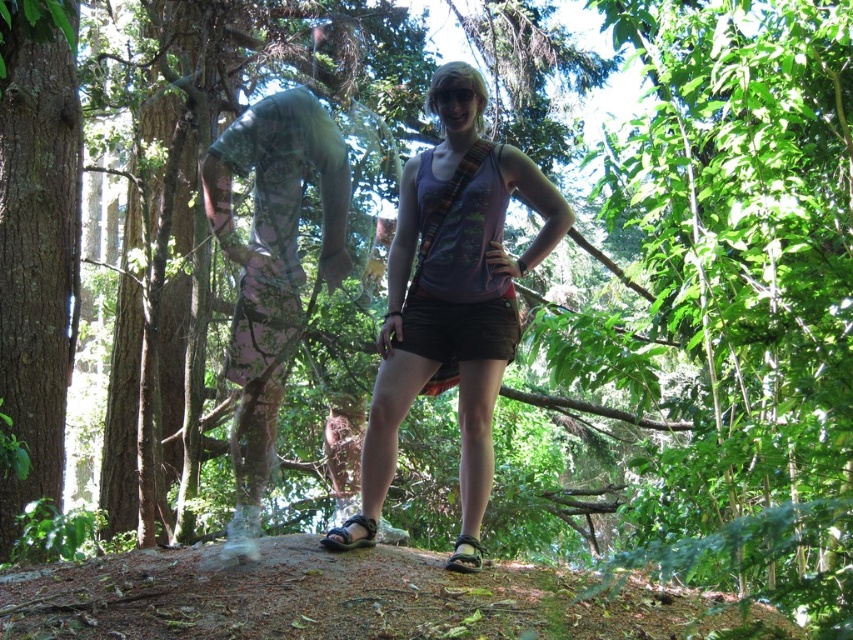
You are a photographer trying to capture both the matte purple tank top at center and the smooth brown bark at left in a single frame. Based on their positions, which object should you adjust your camera angle to focus on first to ensure both are in the frame?

The matte purple tank top at center might be wider than smooth brown bark at left, so you should focus on the matte purple tank top at center first to accommodate its width and ensure both fit in the frame.

You are a photographer trying to capture the person in the purple top. You notice a point marked at coordinates (x=451, y=300). Where exactly on the person should you focus your camera to ensure you capture the purple top accurately?

The point at (x=451, y=300) is located on the matte purple tank top at center, so focusing there will capture the purple top accurately.

You are a photographer trying to capture the matte purple tank top at center in your shot. Based on its position, where should you aim your camera?

The matte purple tank top at center is located at the 2D coordinates point (451,300), so aim your camera at that position to capture it.